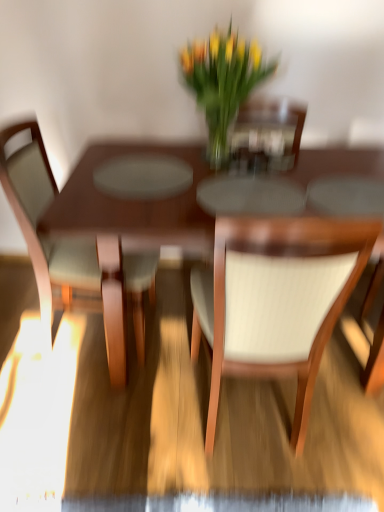
What are the coordinates of `free spot below white textured chair at center, which appears as the second chair when viewed from the left (from a real-world perspective)` in the screenshot? It's located at [x=253, y=435].